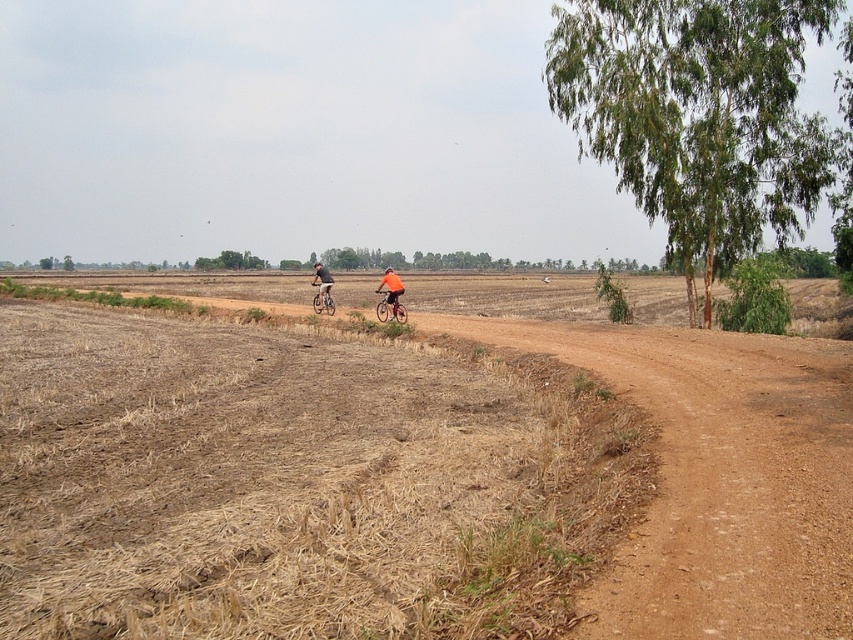
You are a hiker planning to cross the field in the image. You see the brown dry grass at center and the green leafy tree at upper right. Which area would you choose to walk through to avoid getting wet?

The green leafy tree at upper right is a better choice because the brown dry grass at center might be wider and could indicate a wetter area. However, since the scene describes an arid and brown ground, both areas might be dry, but the tree provides shade and possibly firmer ground.

You are a photographer planning to capture the cyclists in the rural landscape. You want to ensure the orange fabric cyclist at center is clearly visible against the background. Considering the brown dry grass at center, which object should be positioned closer to the camera to create a better contrast?

The orange fabric cyclist at center should be positioned closer to the camera than the brown dry grass at center because the brown dry grass at center is shorter, allowing the cyclist to stand out more against the background.

You are a drone operator trying to capture a photo of the two cyclists in the rural landscape. The drone is currently hovering above the brown dry grass at center. To ensure the cyclists are in the frame, should you move the drone north or south? Please explain your reasoning based on their positions.

The brown dry grass at center is located at coordinates (293, 481). Since the cyclists are positioned along the dirt path which curves to the right in the midground, moving the drone north would align it closer to the cyclists, ensuring they are in the frame. Moving south would take the drone away from their position.